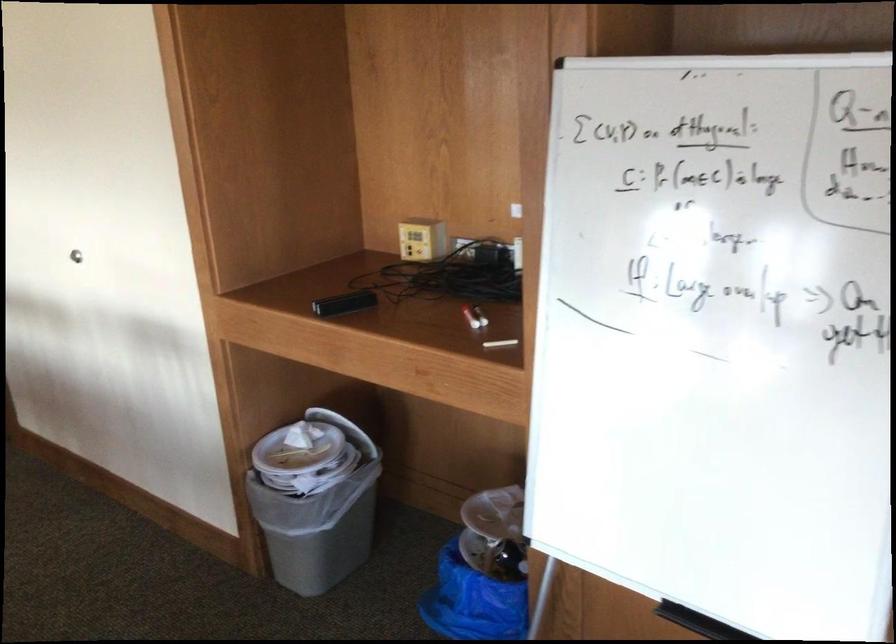
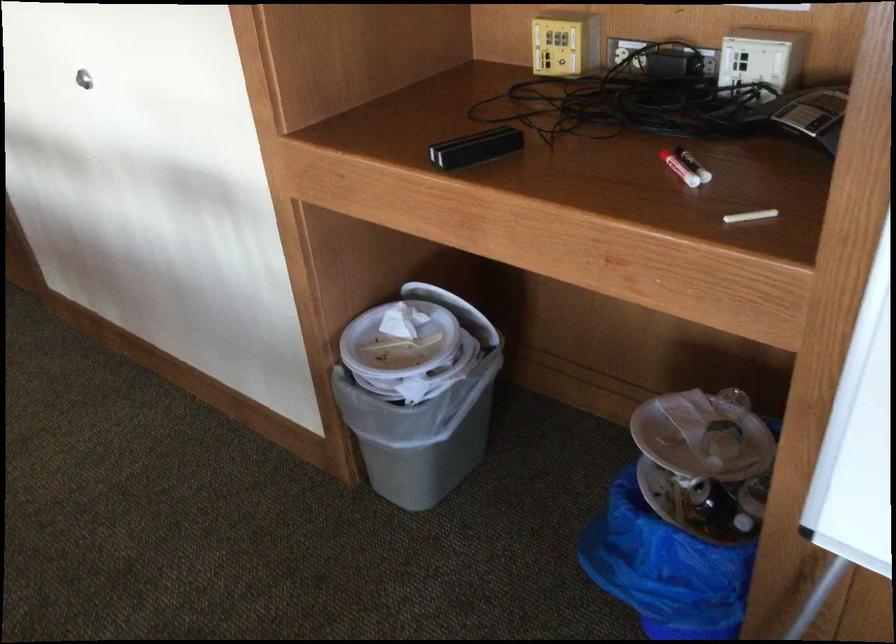
In a continuous first-person perspective shot, in which direction is the camera moving?

The movement direction of the cameraman is left, forward.